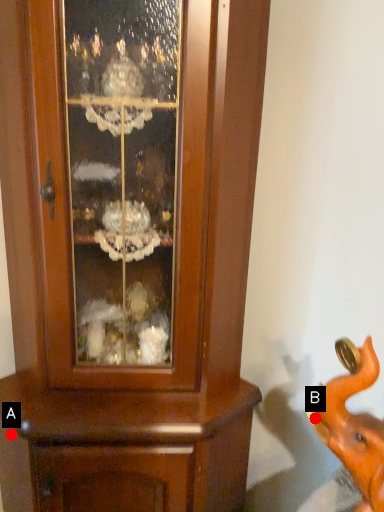
Question: Two points are circled on the image, labeled by A and B beside each circle. Which point appears farthest from the camera in this image?

Choices:
 (A) A is further
 (B) B is further

Answer: (A)